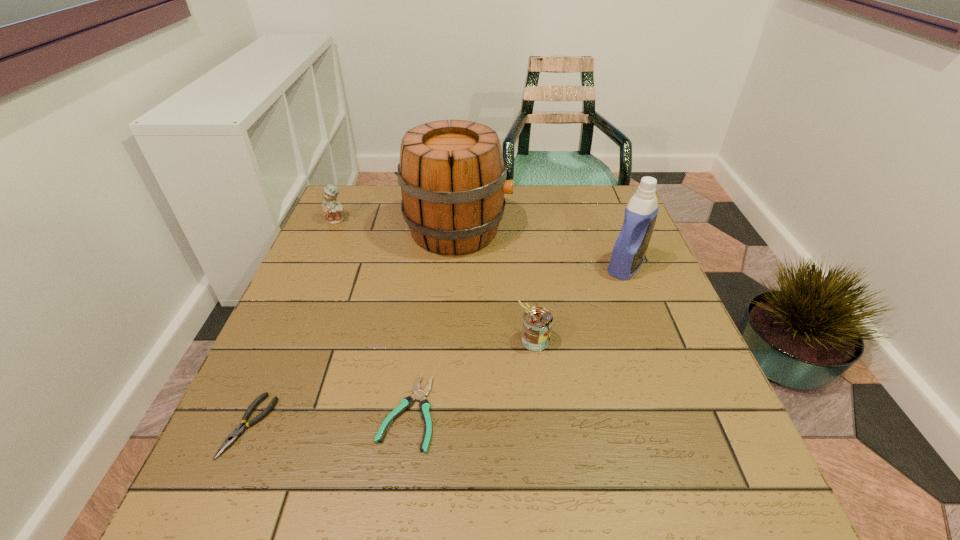
Where is `vacant space located on the front-facing side of the teddy bear`? Image resolution: width=960 pixels, height=540 pixels. vacant space located on the front-facing side of the teddy bear is located at coordinates (327, 241).

Image resolution: width=960 pixels, height=540 pixels. Find the location of `vacant area located on the left of the can`. vacant area located on the left of the can is located at coordinates (400, 340).

Find the location of `blank area located 0.180m on the back of the left pliers`. blank area located 0.180m on the back of the left pliers is located at coordinates (293, 326).

Find the location of a particular element. This screenshot has width=960, height=540. free spot located on the right of the right pliers is located at coordinates (601, 413).

Where is `cider that is at the far edge`? The width and height of the screenshot is (960, 540). cider that is at the far edge is located at coordinates (453, 177).

Locate an element on the screen. The width and height of the screenshot is (960, 540). teddy bear positioned at the far edge is located at coordinates (332, 209).

You are a GUI agent. You are given a task and a screenshot of the screen. Output one action in this format:
    pyautogui.click(x=<x>, y=<y>)
    Task: Click on the teddy bear that is at the left edge
    
    Given the screenshot: What is the action you would take?
    [332, 209]

Find the location of `pliers that is positioned at the left edge`. pliers that is positioned at the left edge is located at coordinates (239, 430).

The width and height of the screenshot is (960, 540). What are the coordinates of `object at the right edge` in the screenshot? It's located at pyautogui.click(x=628, y=253).

This screenshot has width=960, height=540. In order to click on object that is at the far left corner in this screenshot , I will do `click(332, 209)`.